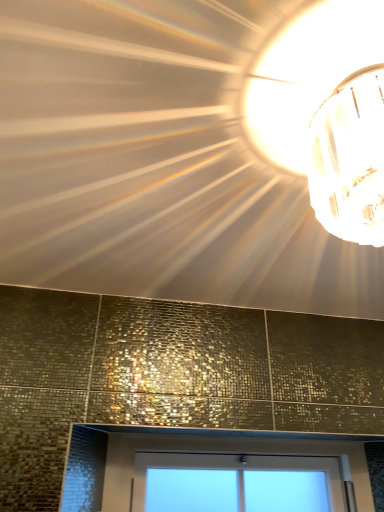
Question: Should I look upward or downward to see matte glass light fixture at upper right?

Choices:
 (A) up
 (B) down

Answer: (A)